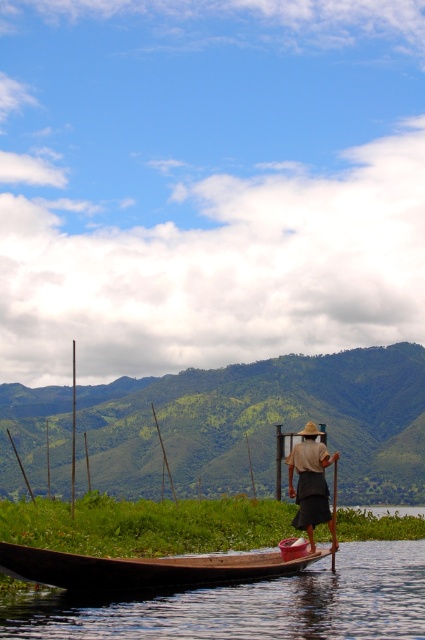
Does point (297, 481) lie in front of point (333, 538)?

No, (297, 481) is further to viewer.

The image size is (425, 640). Identify the location of brown woven hat at center. (311, 483).

Locate an element on the screen. brown woven hat at center is located at coordinates (x=311, y=483).

I want to click on brown wooden boat at lower left, so click(248, 604).

Based on the photo, can you confirm if brown wooden boat at lower left is wider than brown woven hat at center?

Correct, the width of brown wooden boat at lower left exceeds that of brown woven hat at center.

Who is more forward, (82, 624) or (314, 467)?

Point (82, 624) is more forward.

Find the location of a particular element. This screenshot has width=425, height=640. brown wooden boat at lower left is located at coordinates (248, 604).

Can you confirm if brown wooden boat at lower left is positioned to the right of brown wooden canoe at lower center?

Indeed, brown wooden boat at lower left is positioned on the right side of brown wooden canoe at lower center.

In the scene shown: Is brown wooden boat at lower left shorter than brown wooden canoe at lower center?

In fact, brown wooden boat at lower left may be taller than brown wooden canoe at lower center.

Identify the location of brown wooden boat at lower left. Image resolution: width=425 pixels, height=640 pixels. (248, 604).

Find the location of a particular element. brown wooden boat at lower left is located at coordinates (248, 604).